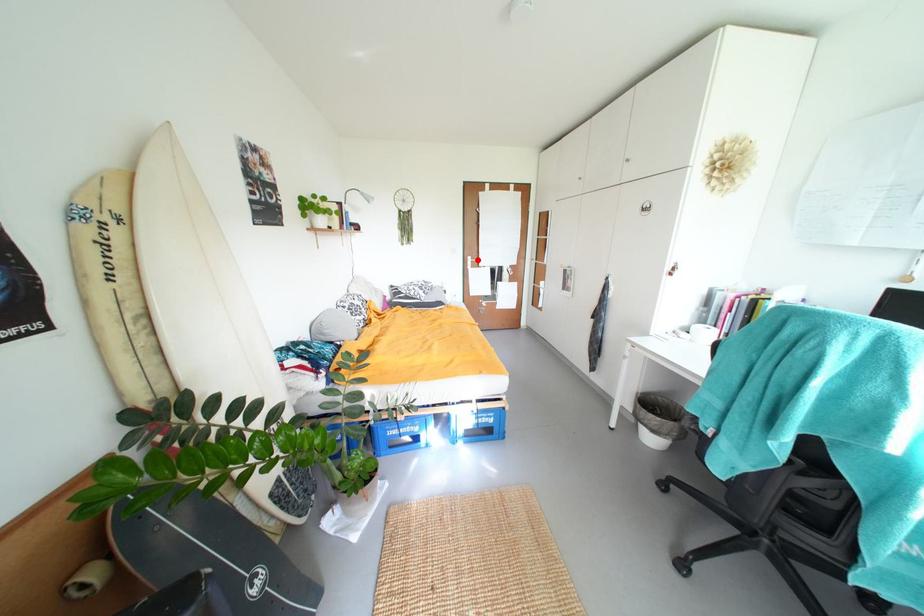
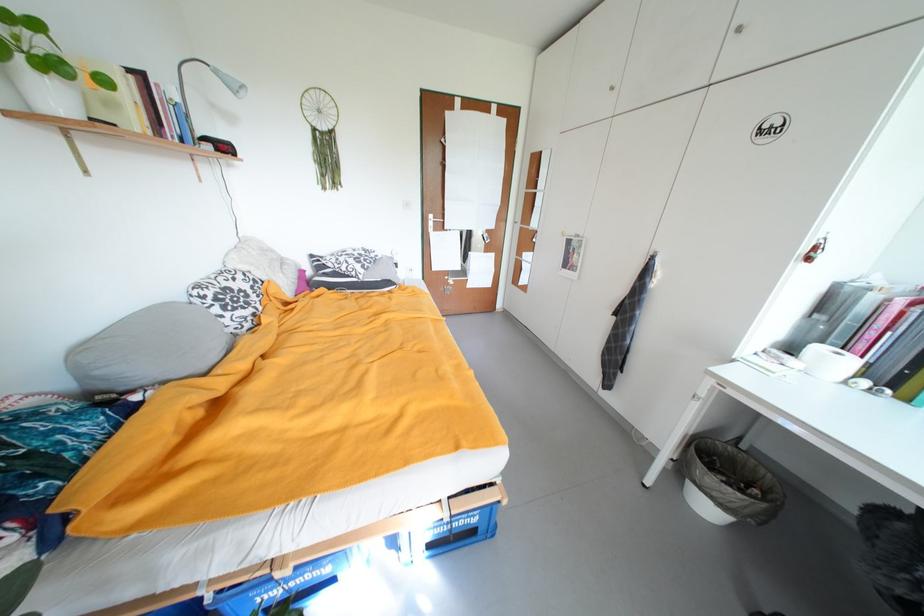
Where in the second image is the point corresponding to the highlighted location from the first image?

(439, 217)